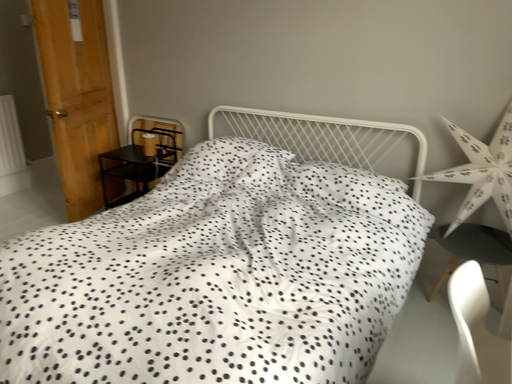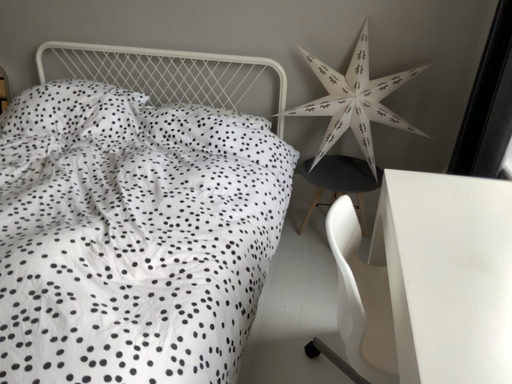
Question: How did the camera likely rotate when shooting the video?

Choices:
 (A) rotated left
 (B) rotated right

Answer: (B)